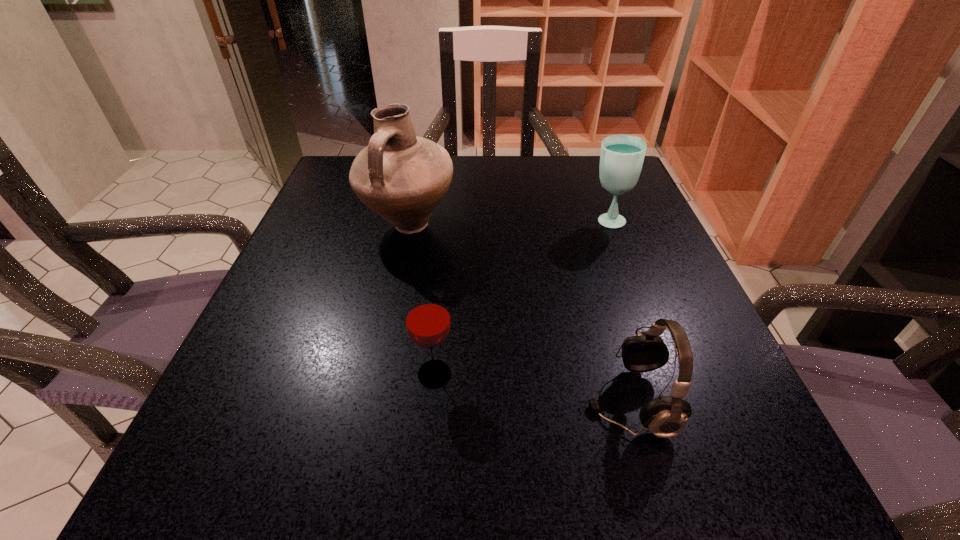
The image size is (960, 540). Find the location of `vacant point located 0.260m with the microphone on the side of the headset`. vacant point located 0.260m with the microphone on the side of the headset is located at coordinates (398, 401).

Locate an element on the screen. The height and width of the screenshot is (540, 960). object that is at the far edge is located at coordinates (402, 177).

You are a GUI agent. You are given a task and a screenshot of the screen. Output one action in this format:
    pyautogui.click(x=<x>, y=<y>)
    Task: Click on the object that is at the near edge
    The width and height of the screenshot is (960, 540).
    Given the screenshot: What is the action you would take?
    pyautogui.click(x=666, y=416)

This screenshot has width=960, height=540. In order to click on object present at the left edge in this screenshot , I will do `click(402, 177)`.

Locate an element on the screen. The image size is (960, 540). glass present at the right edge is located at coordinates (622, 155).

Where is `headset that is positioned at the right edge`? The width and height of the screenshot is (960, 540). headset that is positioned at the right edge is located at coordinates (666, 416).

Identify the location of object positioned at the far left corner. Image resolution: width=960 pixels, height=540 pixels. (402, 177).

You are a GUI agent. You are given a task and a screenshot of the screen. Output one action in this format:
    pyautogui.click(x=<x>, y=<y>)
    Task: Click on the object present at the near right corner
    
    Given the screenshot: What is the action you would take?
    pyautogui.click(x=666, y=416)

You are a GUI agent. You are given a task and a screenshot of the screen. Output one action in this format:
    pyautogui.click(x=<x>, y=<y>)
    Task: Click on the free region at the far edge of the desktop
    The width and height of the screenshot is (960, 540).
    Given the screenshot: What is the action you would take?
    pyautogui.click(x=515, y=193)

In the image, there is a desktop. Where is `free space at the near edge`? This screenshot has height=540, width=960. free space at the near edge is located at coordinates (468, 510).